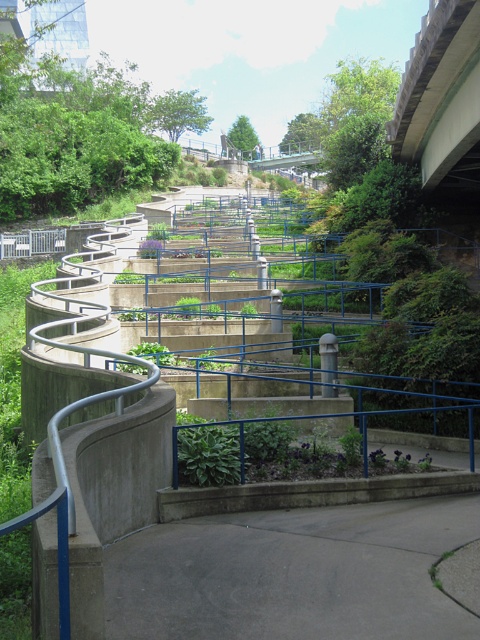
You are a gardener with a 1.2 meter wide lawnmower. You need to mow the gray concrete path at lower center and the concrete bridge at upper right. Which path can the lawnmower fit through?

The gray concrete path at lower center is narrower than the concrete bridge at upper right. Since the lawnmower is 1.2 meters wide, it can only fit through the concrete bridge at upper right, which is wider than the gray concrete path at lower center.

You are a gardener standing on the gray concrete path at lower center and want to reach the concrete bridge at upper right. Which direction should you move to get there?

Since the gray concrete path at lower center is positioned under the concrete bridge at upper right, you should move upward along the gray concrete path at lower center to reach the concrete bridge at upper right.